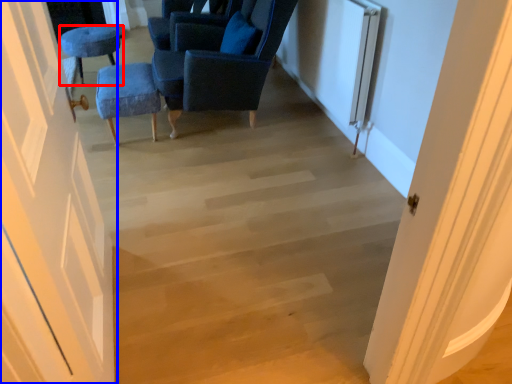
Question: Which object appears closest to the camera in this image, furniture (highlighted by a red box) or door (highlighted by a blue box)?

Choices:
 (A) furniture
 (B) door

Answer: (B)